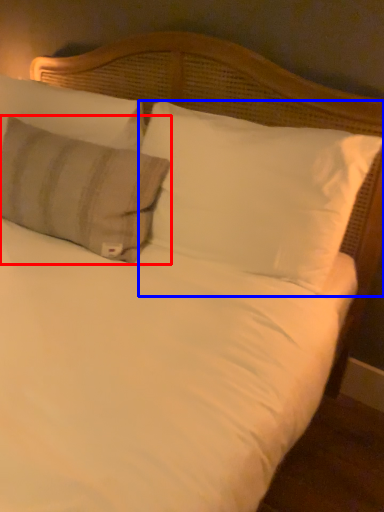
Question: Among these objects, which one is nearest to the camera, pillow (highlighted by a red box) or pillow (highlighted by a blue box)?

Choices:
 (A) pillow
 (B) pillow

Answer: (B)